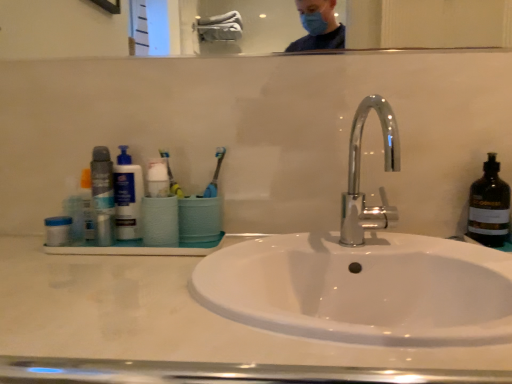
The image size is (512, 384). Identify the location of empty space that is ontop of white glossy sink at center (from a real-world perspective). (147, 269).